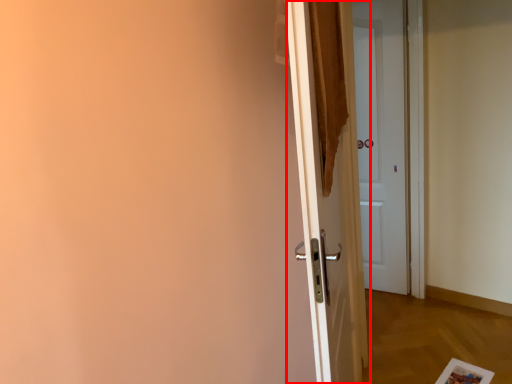
Question: Where is door (annotated by the red box) located in relation to door in the image?

Choices:
 (A) left
 (B) right

Answer: (A)